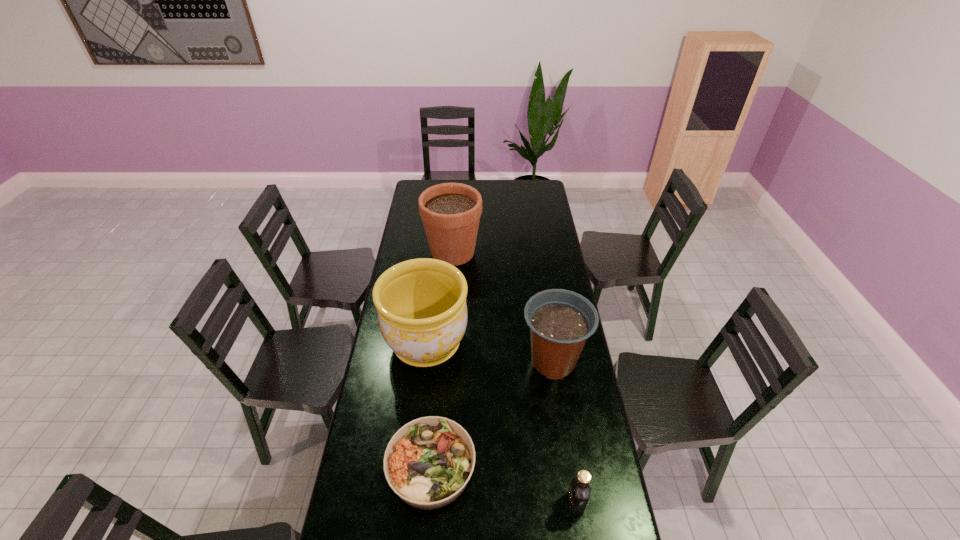
Locate an element on the screen. the farthest flowerpot is located at coordinates (450, 212).

At what (x,y) coordinates should I click in order to perform the action: click on the third shortest object. Please return your answer as a coordinate pair (x, y). This screenshot has height=540, width=960. Looking at the image, I should click on (560, 321).

This screenshot has height=540, width=960. I want to click on the shortest flowerpot, so click(x=560, y=321).

The height and width of the screenshot is (540, 960). Find the location of `the fourth tallest object`. the fourth tallest object is located at coordinates (578, 495).

Where is `salad plate`? salad plate is located at coordinates (428, 462).

Where is `free spot located 0.150m on the front of the farthest flowerpot`? free spot located 0.150m on the front of the farthest flowerpot is located at coordinates (450, 292).

In order to click on vacant space located 0.210m on the front of the third tallest object in this screenshot , I will do `click(565, 442)`.

At what (x,y) coordinates should I click in order to perform the action: click on free space located 0.350m on the front-facing side of the vodka. Please return your answer as a coordinate pair (x, y). The height and width of the screenshot is (540, 960). Looking at the image, I should click on (455, 503).

At what (x,y) coordinates should I click in order to perform the action: click on vacant region located on the front-facing side of the vodka. Please return your answer as a coordinate pair (x, y). Looking at the image, I should click on (529, 503).

I want to click on vacant space located 0.210m on the front-facing side of the vodka, so click(500, 503).